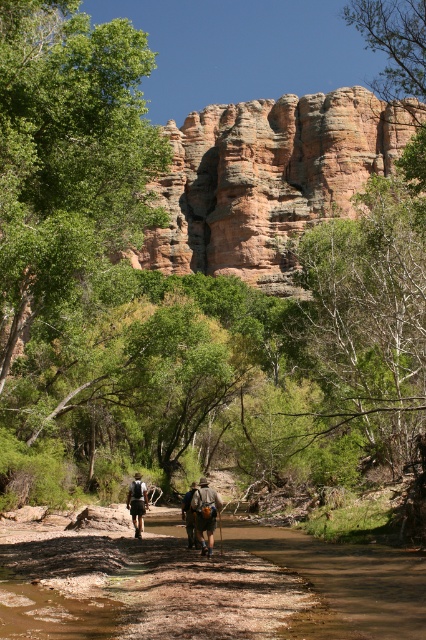
You are a hiker who wants to take a photo of the brown leather horse at center and the matte black backpack at center. Since you want to include both in the frame, which object should you focus on first to ensure both are in focus?

The brown leather horse at center is positioned under the matte black backpack at center, so you should focus on the matte black backpack at center first to ensure both are in focus.

You are a photographer planning to take a photo of the rustic sandstone cliff at center and the brown leather horse at center. Which object should you focus on first if you want to capture both in a single frame without moving the camera?

The rustic sandstone cliff at center is taller than the brown leather horse at center, so you should focus on the rustic sandstone cliff at center first to ensure it fits within the frame.